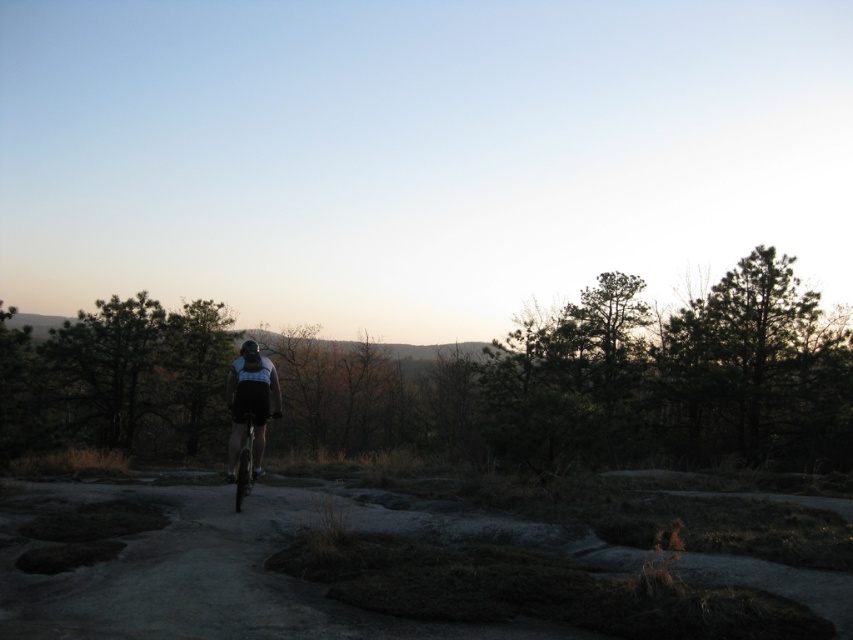
Between dull gray dirt track at center and matte black shorts at center, which one appears on the right side from the viewer's perspective?

Positioned to the right is dull gray dirt track at center.

Between dull gray dirt track at center and matte black shorts at center, which one is positioned lower?

matte black shorts at center is below.

Identify the location of dull gray dirt track at center. (242, 570).

Does dull gray dirt track at center appear on the left side of black matte helmet at center?

No, dull gray dirt track at center is not to the left of black matte helmet at center.

Who is taller, dull gray dirt track at center or black matte helmet at center?

With more height is dull gray dirt track at center.

Which is in front, point (640, 552) or point (248, 342)?

Positioned in front is point (640, 552).

At what (x,y) coordinates should I click in order to perform the action: click on dull gray dirt track at center. Please return your answer as a coordinate pair (x, y). This screenshot has height=640, width=853. Looking at the image, I should click on (242, 570).

Who is lower down, matte black shorts at center or metallic silver bicycle at center?

matte black shorts at center is below.

Can you confirm if matte black shorts at center is taller than metallic silver bicycle at center?

Yes.

Who is more forward, (231, 390) or (242, 456)?

Point (242, 456) is more forward.

Locate an element on the screen. matte black shorts at center is located at coordinates (250, 403).